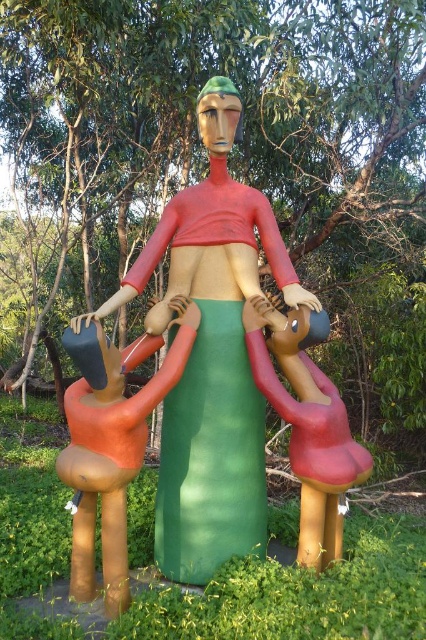
Based on the provided scene description, where is the matte green dress at center located in terms of its 2D coordinates?

The matte green dress at center is located at the 2D coordinates point (212, 355).

Which of the two figures, the matte orange figure at lower left or the matte red figure at center, is positioned to the left?

The matte orange figure at lower left is positioned to the left of the matte red figure at center.

You are an artist planning to create a miniature version of the sculpture. You have a limited amount of green material. If the matte orange figure at lower left requires 200 grams of orange material, how much green material do you need for the matte green dress at center?

The matte green dress at center is bigger than the matte orange figure at lower left. Since the orange figure requires 200 grams of material, the green dress would require more than 200 grams of green material.